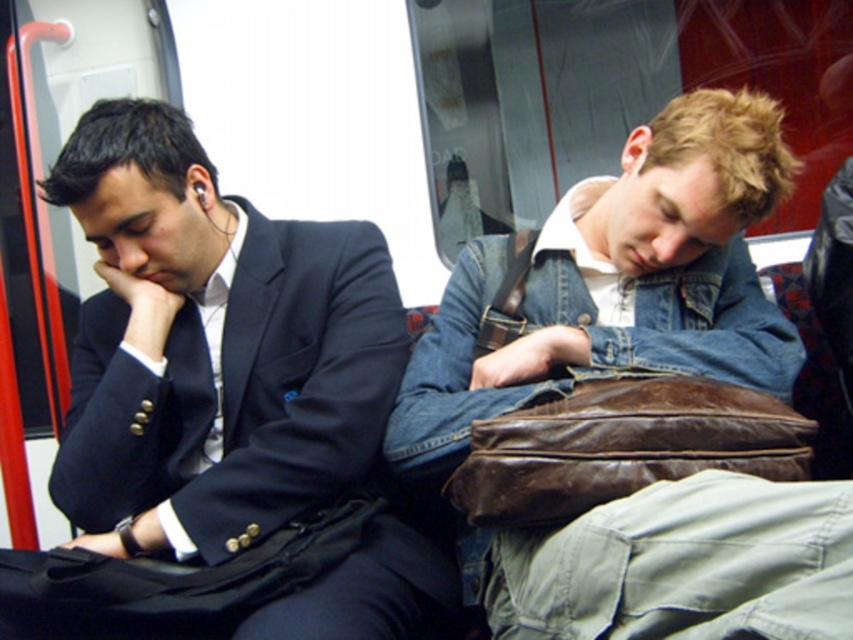
Question: Can you confirm if matte black suit at left is positioned to the left of denim jacket at center?

Choices:
 (A) yes
 (B) no

Answer: (A)

Question: Is matte black suit at left smaller than denim jacket at center?

Choices:
 (A) yes
 (B) no

Answer: (A)

Question: Which of the following is the farthest from the observer?

Choices:
 (A) (561, 248)
 (B) (152, 611)

Answer: (A)

Question: Among these objects, which one is farthest from the camera?

Choices:
 (A) matte black suit at left
 (B) denim jacket at center

Answer: (A)

Question: Which object appears farthest from the camera in this image?

Choices:
 (A) matte black suit at left
 (B) denim jacket at center

Answer: (A)

Question: Does matte black suit at left come in front of denim jacket at center?

Choices:
 (A) yes
 (B) no

Answer: (B)